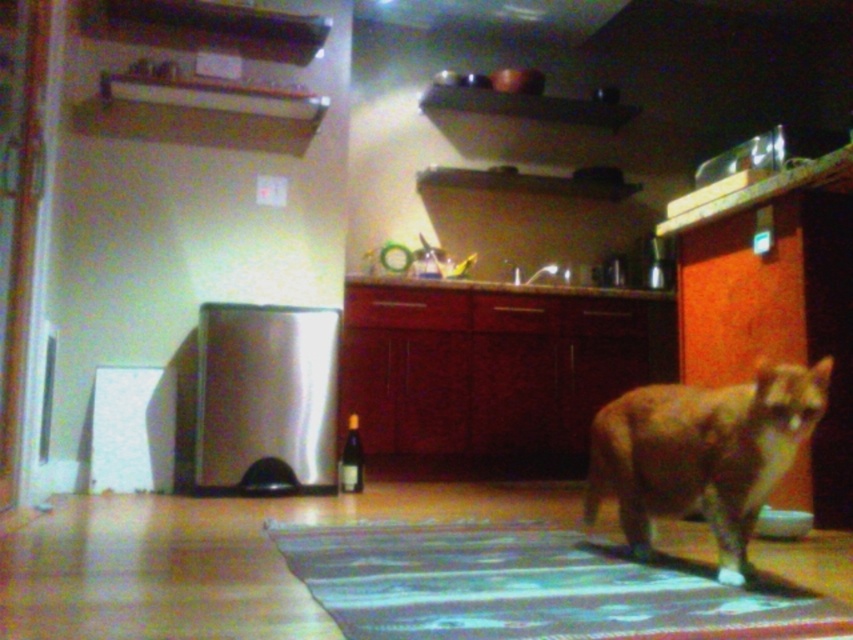
Question: Which point is farther to the camera?

Choices:
 (A) (770, 476)
 (B) (323, 586)

Answer: (A)

Question: Which point appears farthest from the camera in this image?

Choices:
 (A) (726, 529)
 (B) (287, 566)

Answer: (B)

Question: Which object is farther from the camera taking this photo?

Choices:
 (A) blue textured rug at center
 (B) orange fur cat at center

Answer: (B)

Question: Is blue textured rug at center above orange fur cat at center?

Choices:
 (A) no
 (B) yes

Answer: (A)

Question: Does blue textured rug at center have a smaller size compared to orange fur cat at center?

Choices:
 (A) no
 (B) yes

Answer: (A)

Question: Can you confirm if blue textured rug at center is positioned to the right of orange fur cat at center?

Choices:
 (A) yes
 (B) no

Answer: (B)